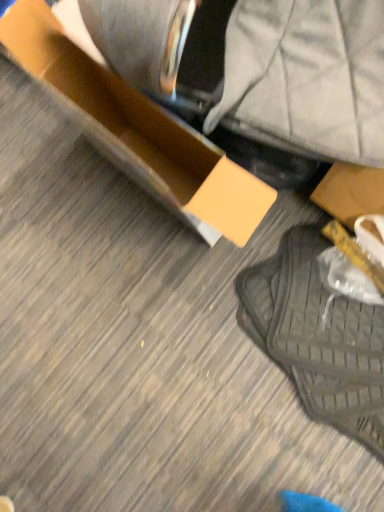
Where is `vacant area situated to the left side of black mesh bag at lower right`? The height and width of the screenshot is (512, 384). vacant area situated to the left side of black mesh bag at lower right is located at coordinates (185, 388).